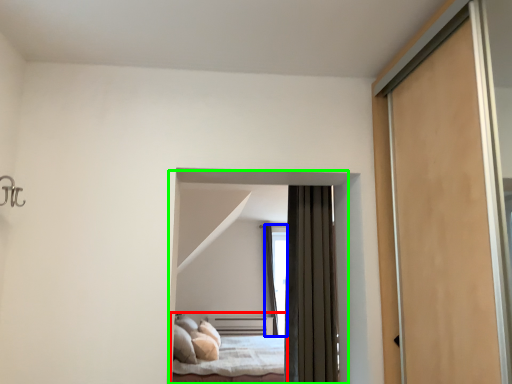
Question: Which object is the farthest from bed (highlighted by a red box)? Choose among these: window (highlighted by a blue box) or bed (highlighted by a green box).

Choices:
 (A) window
 (B) bed

Answer: (B)